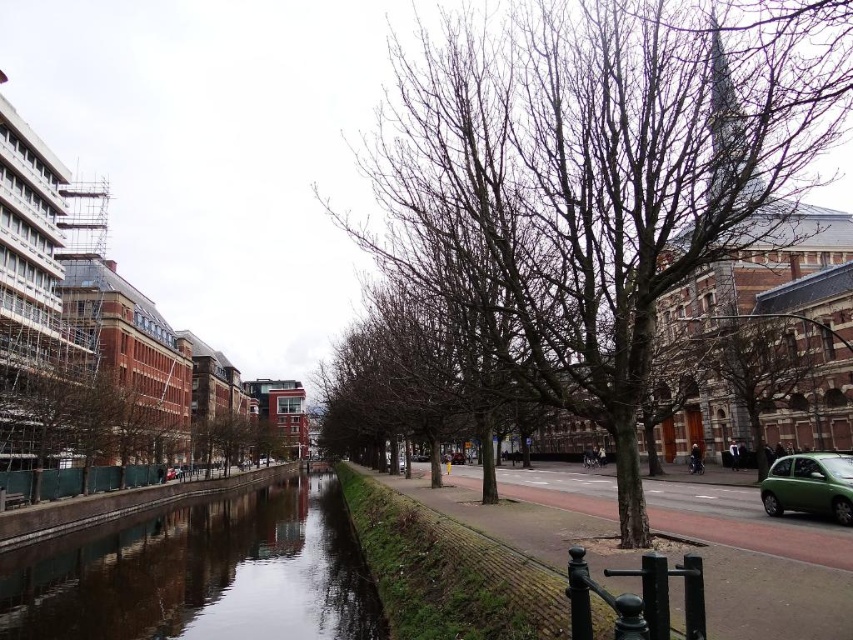
In the scene shown: You are standing at the canal walkway and want to take a photo. You see two points marked in the scene. The first point is at coordinates point [532,275] and the second point is at point [828,467]. Which point is closer to you?

Point [532,275] is closer to you because it is further to the viewer than point [828,467].

You are a city planner assessing the space between the smooth concrete canal at center and the bare wood tree at center. Which object occupies more area in the scene?

The smooth concrete canal at center is bigger than the bare wood tree at center, so it occupies more area in the scene.